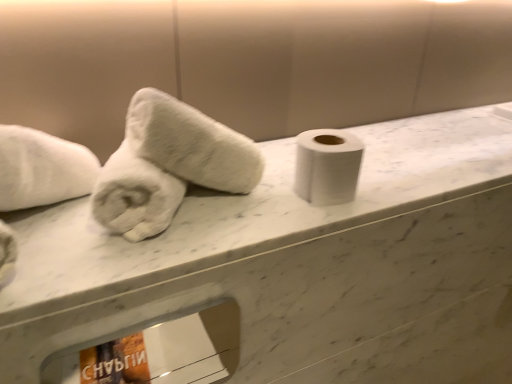
The image size is (512, 384). In order to click on vacant space that is to the left of white matte toilet paper at center in this screenshot , I will do `click(250, 209)`.